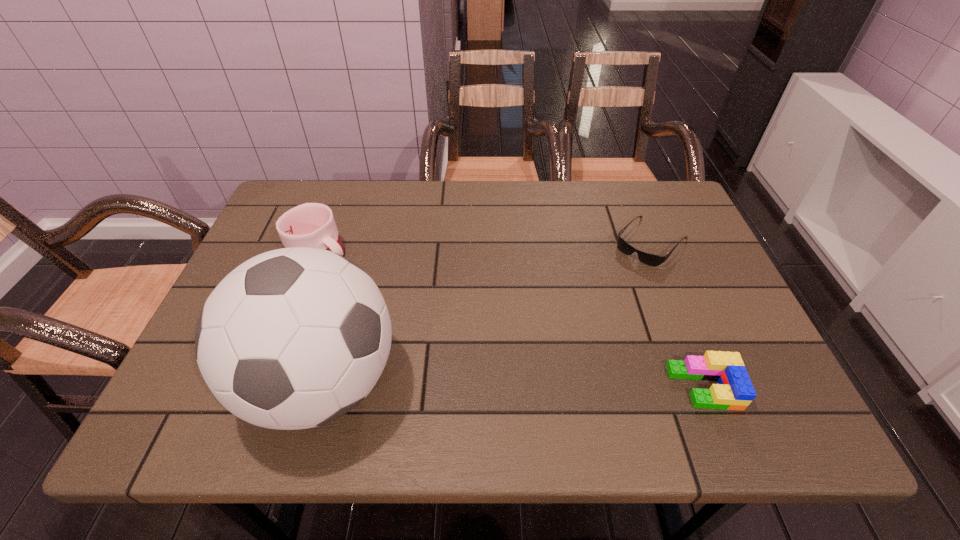
Find the location of `blank area located 0.050m on the side with the handle of the mug`. blank area located 0.050m on the side with the handle of the mug is located at coordinates (352, 276).

You are a GUI agent. You are given a task and a screenshot of the screen. Output one action in this format:
    pyautogui.click(x=<x>, y=<y>)
    Task: Click on the free space located on the side with the handle of the mug
    
    Given the screenshot: What is the action you would take?
    pyautogui.click(x=360, y=282)

The image size is (960, 540). Find the location of `object located in the far edge section of the desktop`. object located in the far edge section of the desktop is located at coordinates (649, 259).

This screenshot has width=960, height=540. What are the coordinates of `soccer ball at the near edge` in the screenshot? It's located at (294, 338).

Image resolution: width=960 pixels, height=540 pixels. In order to click on Lego that is positioned at the near edge in this screenshot , I will do `click(734, 391)`.

Where is `soccer ball situated at the left edge`? soccer ball situated at the left edge is located at coordinates (294, 338).

Find the location of a particular element. mug present at the left edge is located at coordinates (312, 225).

Identify the location of Lego at the right edge. This screenshot has width=960, height=540. [734, 391].

Locate an element on the screen. sunglasses at the right edge is located at coordinates (649, 259).

At what (x,y) coordinates should I click in order to perform the action: click on object present at the near left corner. Please return your answer as a coordinate pair (x, y). This screenshot has height=540, width=960. Looking at the image, I should click on (294, 338).